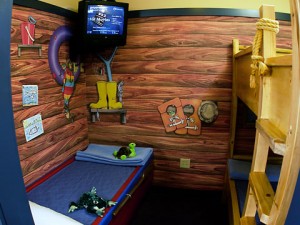
Where is `1 single bed`? Image resolution: width=300 pixels, height=225 pixels. 1 single bed is located at coordinates (96, 179).